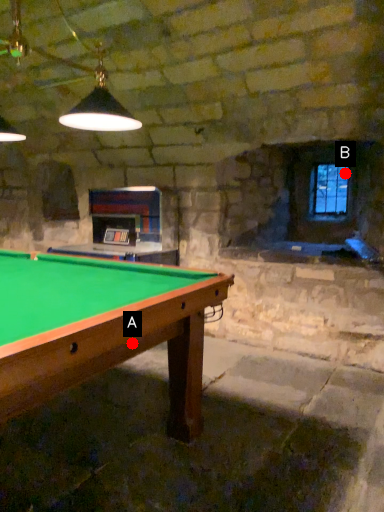
Question: Two points are circled on the image, labeled by A and B beside each circle. Which point is farther to the camera?

Choices:
 (A) A is further
 (B) B is further

Answer: (B)